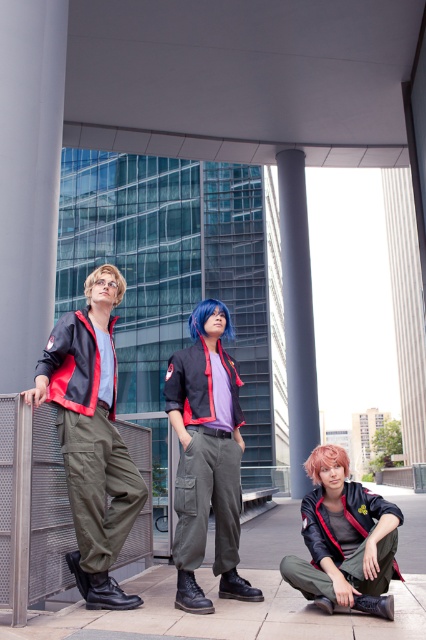
Question: Considering the relative positions of pink matte hair at lower center and blondehair at upper left in the image provided, where is pink matte hair at lower center located with respect to blondehair at upper left?

Choices:
 (A) left
 (B) right

Answer: (B)

Question: Is pink matte hair at lower center to the left of blondehair at upper left from the viewer's perspective?

Choices:
 (A) no
 (B) yes

Answer: (A)

Question: Which object is closer to the camera taking this photo?

Choices:
 (A) pink matte hair at lower center
 (B) olive green cargo pants at left
 (C) smooth concrete pillar at center
 (D) matte black jacket at center

Answer: (B)

Question: Which point is farther to the camera?

Choices:
 (A) blue matte wig at center
 (B) concrete pavement at lower center
 (C) olive green cargo pants at left
 (D) matte black jacket at center

Answer: (A)

Question: Considering the real-world distances, which object is closest to the blondehair at upper left?

Choices:
 (A) pink matte hair at lower center
 (B) smooth concrete pillar at center
 (C) olive green cargo pants at left

Answer: (C)

Question: Can you confirm if olive green cargo pants at left is positioned to the left of blue matte wig at center?

Choices:
 (A) no
 (B) yes

Answer: (B)